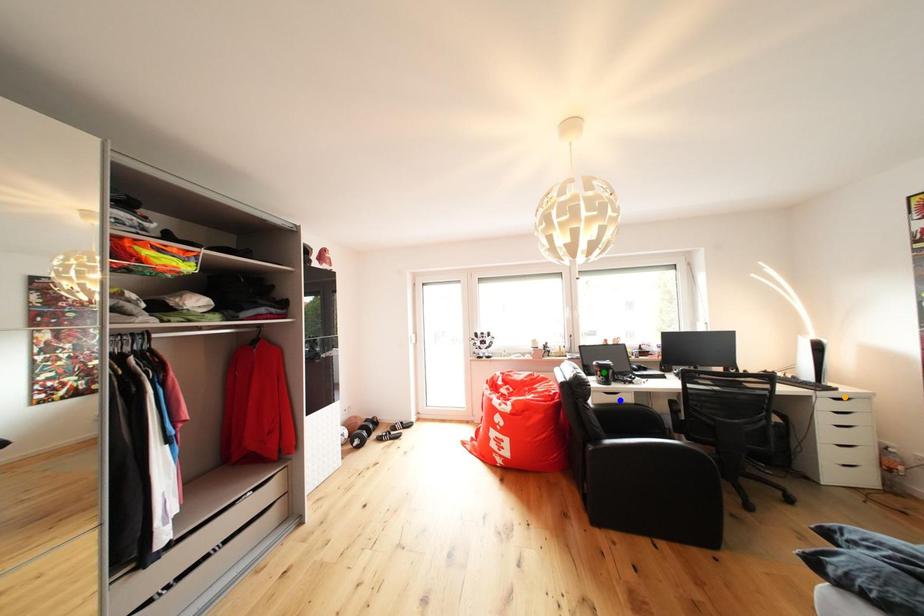
Order these from nearest to farthest:
1. orange point
2. blue point
3. green point

orange point, blue point, green point